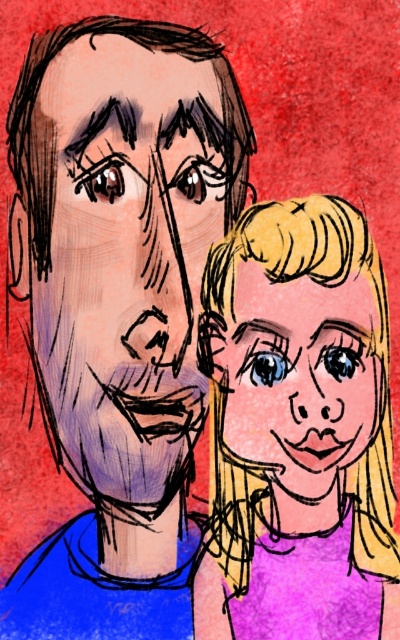
Question: Does purple matte hair at right appear under matte purple face at center?

Choices:
 (A) yes
 (B) no

Answer: (A)

Question: Which is nearer to the smooth blonde hair at center?

Choices:
 (A) purple matte hair at right
 (B) matte purple face at center

Answer: (A)

Question: Is purple matte hair at right positioned at the back of smooth blonde hair at center?

Choices:
 (A) yes
 (B) no

Answer: (B)

Question: Does purple matte hair at right have a lesser width compared to smooth blonde hair at center?

Choices:
 (A) no
 (B) yes

Answer: (A)

Question: Which point is closer to the camera?

Choices:
 (A) purple matte hair at right
 (B) smooth blonde hair at center

Answer: (A)

Question: Which point is closer to the camera?

Choices:
 (A) purple matte hair at right
 (B) smooth blonde hair at center
 (C) matte purple face at center

Answer: (A)